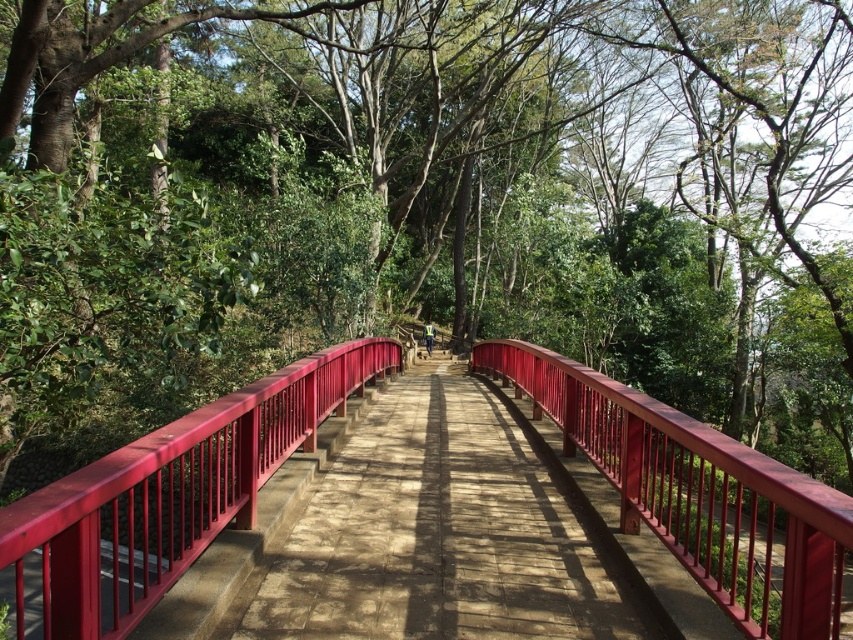
You are a hiker walking along the pathway and want to cross the matte red bridge at center. However, you have a tall backpack that stands 1.5 meters in height. Can you safely pass under the glossy wood rail at center without hitting your backpack?

The glossy wood rail at center is taller than the matte red bridge at center. Since your backpack is 1.5 meters tall, you need to ensure there is enough clearance. However, the matte red bridge at center is shorter than the glossy wood rail at center, so the bridge might not provide sufficient height for your backpack. You should check the actual height of the bridge before proceeding.

You are standing at the start of the forest path and see both the smooth wooden bridge at center and the matte red bridge at center. Which bridge is closer to you?

The smooth wooden bridge at center is closer to you because it is positioned further to the viewer than the matte red bridge at center.